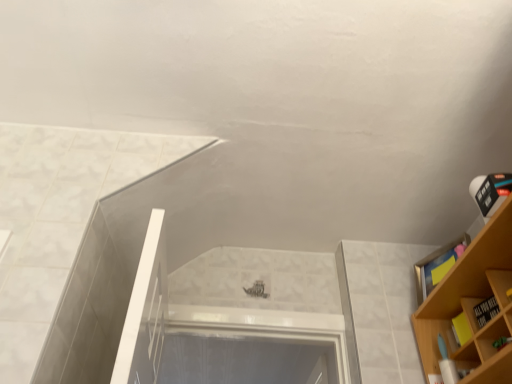
Measure the distance between point (447, 246) and camera.

A distance of 1.84 meters exists between point (447, 246) and camera.

The image size is (512, 384). I want to click on wooden cabinet at upper right, so click(x=437, y=266).

Describe the element at coordinates (437, 266) in the screenshot. The width and height of the screenshot is (512, 384). I see `wooden cabinet at upper right` at that location.

The image size is (512, 384). Find the location of `wooden cabinet at upper right`. wooden cabinet at upper right is located at coordinates (437, 266).